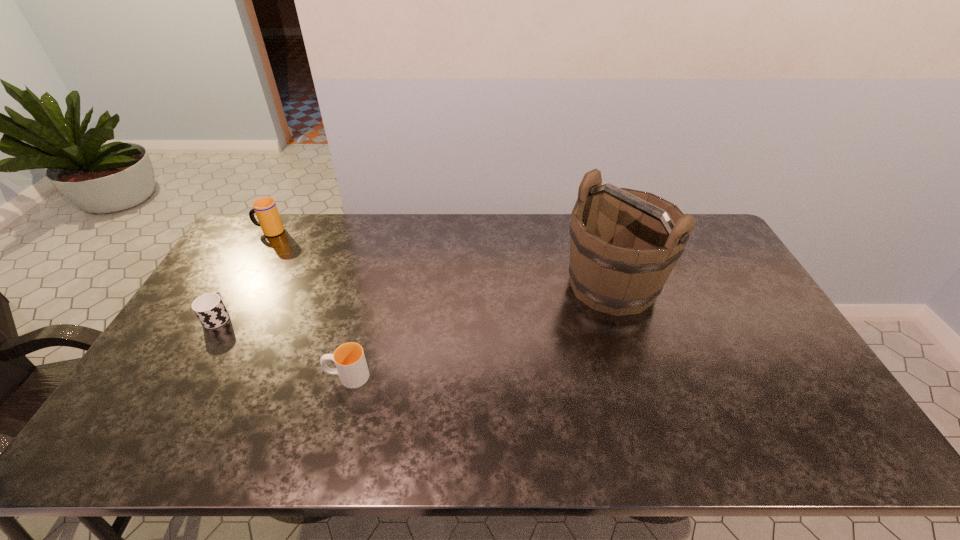
At what (x,y) coordinates should I click in order to perform the action: click on free space between the second shortest object and the bucket. Please return your answer as a coordinate pair (x, y). The height and width of the screenshot is (540, 960). Looking at the image, I should click on (480, 330).

Where is `unoccupied position between the shortest object and the tallest cup`? unoccupied position between the shortest object and the tallest cup is located at coordinates (244, 274).

Identify the location of vacant space in between the second farthest cup and the bucket. This screenshot has width=960, height=540. (415, 301).

Find the location of `object that stands as the second closest to the third shortest object`. object that stands as the second closest to the third shortest object is located at coordinates (x=349, y=358).

Where is `object identified as the second closest to the second farthest cup`? The width and height of the screenshot is (960, 540). object identified as the second closest to the second farthest cup is located at coordinates (349, 358).

At what (x,y) coordinates should I click in order to perform the action: click on the closest cup to the rightmost object. Please return your answer as a coordinate pair (x, y). Looking at the image, I should click on (349, 358).

Identify the location of the closest cup to the third object from left to right. pyautogui.click(x=209, y=308).

This screenshot has height=540, width=960. I want to click on vacant point that satisfies the following two spatial constraints: 1. on the side of the shortest object with the handle; 2. on the right side of the rightmost object, so click(x=237, y=285).

I want to click on vacant space that satisfies the following two spatial constraints: 1. on the side of the shortest object with the handle; 2. on the left side of the rightmost object, so click(x=237, y=285).

Locate an element on the screen. blank area in the image that satisfies the following two spatial constraints: 1. with the handle on the side of the third tallest object; 2. on the back side of the bucket is located at coordinates (372, 285).